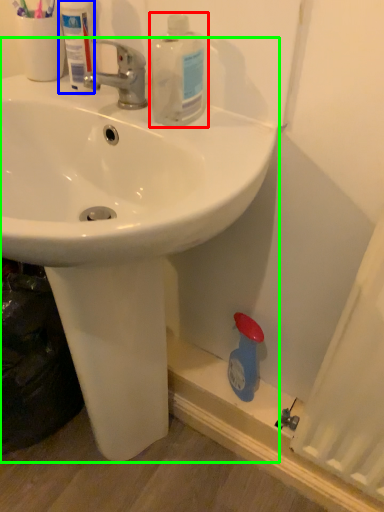
Question: Considering the real-world distances, which object is farthest from cleaning product (highlighted by a red box)? mouthwash (highlighted by a blue box) or sink (highlighted by a green box)?

Choices:
 (A) mouthwash
 (B) sink

Answer: (B)